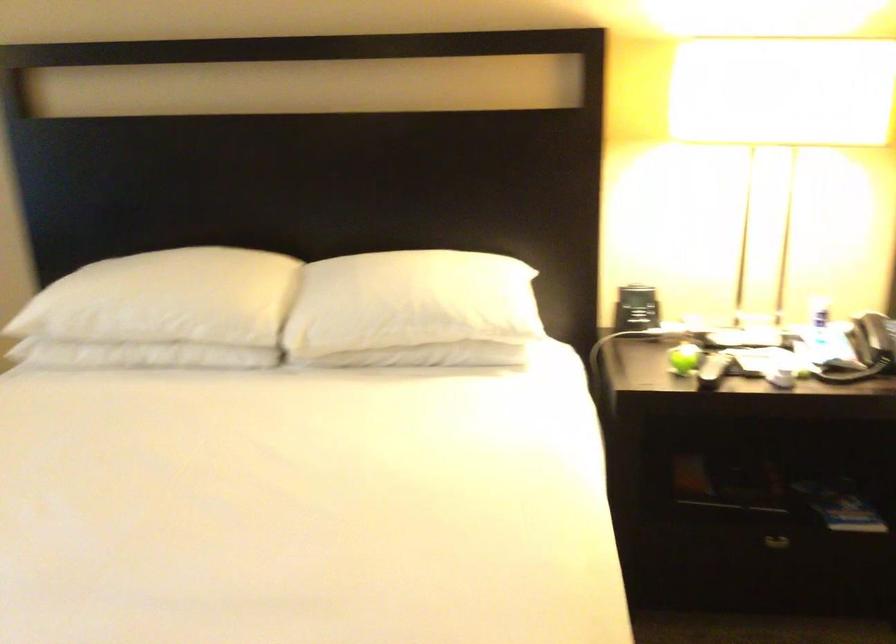
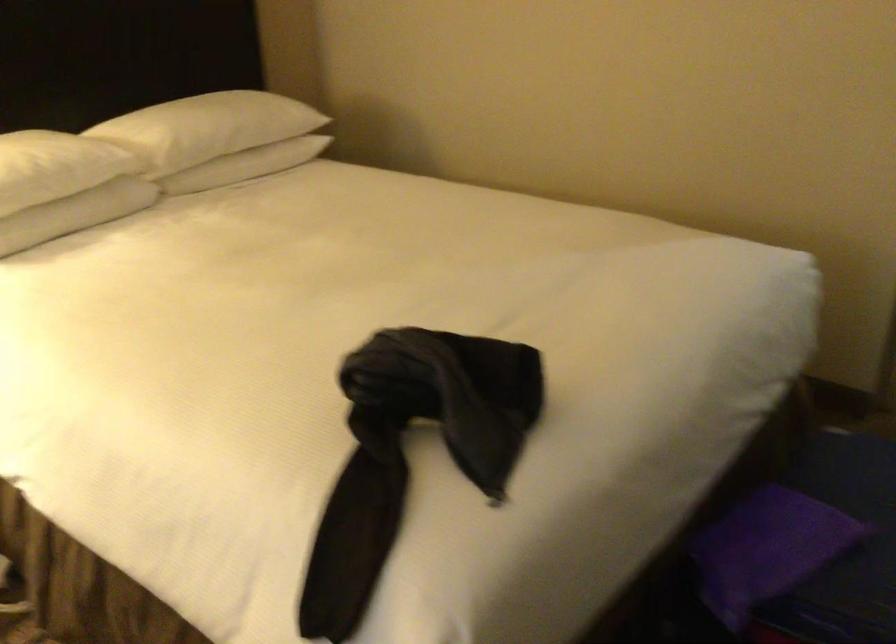
Question: The camera is either moving clockwise (left) or counter-clockwise (right) around the object. The first image is from the beginning of the video and the second image is from the end. Is the camera moving left or right when shooting the video?

Choices:
 (A) Left
 (B) Right

Answer: (A)